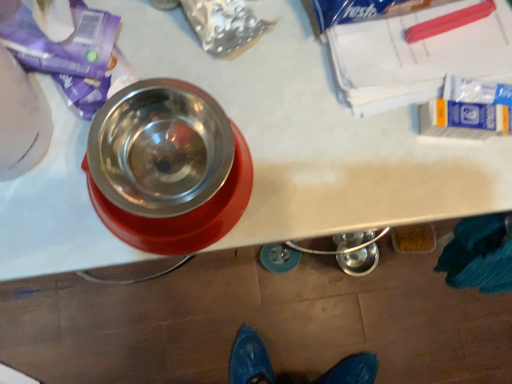
Question: Would you say translucent plastic container at lower right is to the left or to the right of metallic stainless steel bowl at upper left in the picture?

Choices:
 (A) left
 (B) right

Answer: (B)

Question: Is translucent plastic container at lower right inside the boundaries of metallic stainless steel bowl at upper left, or outside?

Choices:
 (A) inside
 (B) outside

Answer: (B)

Question: Is translucent plastic container at lower right bigger or smaller than metallic stainless steel bowl at upper left?

Choices:
 (A) big
 (B) small

Answer: (B)

Question: Looking at the image, does metallic stainless steel bowl at upper left seem bigger or smaller compared to translucent plastic container at lower right?

Choices:
 (A) small
 (B) big

Answer: (B)

Question: From the image's perspective, relative to translucent plastic container at lower right, is metallic stainless steel bowl at upper left above or below?

Choices:
 (A) above
 (B) below

Answer: (A)

Question: Is metallic stainless steel bowl at upper left wider or thinner than translucent plastic container at lower right?

Choices:
 (A) wide
 (B) thin

Answer: (A)

Question: Is metallic stainless steel bowl at upper left to the left or to the right of translucent plastic container at lower right in the image?

Choices:
 (A) left
 (B) right

Answer: (A)